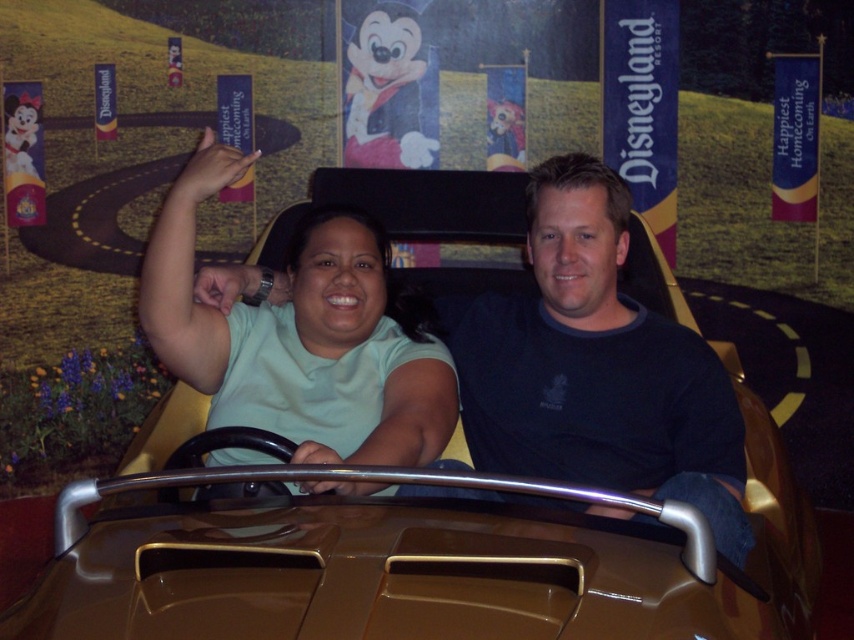
You are a photographer positioned in front of the car. You need to take a photo of both the dark blue shirt at center and the matte green shirt at center. Which shirt will appear closer to the camera in the photo?

The dark blue shirt at center will appear closer to the camera because the matte green shirt at center is behind it.

You are a photographer standing near the gold metallic car at center and the matte green shirt at center. You want to capture both subjects in a single photo. Which object should you focus on first to ensure both are in frame?

The gold metallic car at center has a larger size compared to matte green shirt at center. To ensure both are in frame, focus on the gold metallic car at center first since it takes up more space, allowing the smaller matte green shirt at center to fit naturally within the shot.